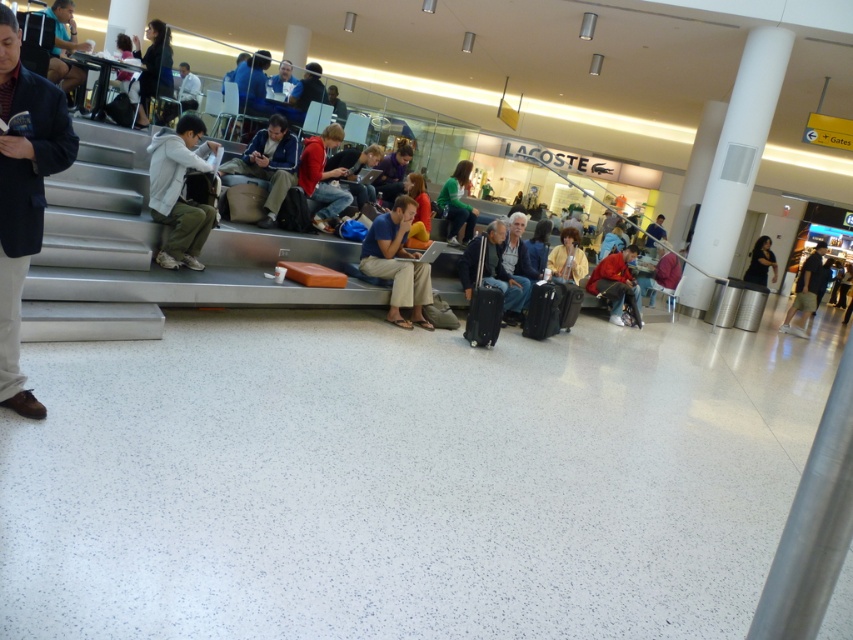
The width and height of the screenshot is (853, 640). Describe the element at coordinates (22, 195) in the screenshot. I see `dark blue blazer at left` at that location.

This screenshot has height=640, width=853. Identify the location of dark blue blazer at left. (22, 195).

The height and width of the screenshot is (640, 853). Identify the location of dark blue blazer at left. (22, 195).

Who is more forward, (556,310) or (567,316)?

Point (556,310) is in front.

Is black matte suitcase at center to the left of black fabric suitcase at center from the viewer's perspective?

Yes, black matte suitcase at center is to the left of black fabric suitcase at center.

Is point (560, 294) in front of point (567, 316)?

Yes, point (560, 294) is closer to viewer.

Locate an element on the screen. The width and height of the screenshot is (853, 640). black matte suitcase at center is located at coordinates (543, 310).

Who is positioned more to the left, black fabric dress at lower right or black fabric suitcase at center?

black fabric suitcase at center

This screenshot has height=640, width=853. What do you see at coordinates (759, 262) in the screenshot?
I see `black fabric dress at lower right` at bounding box center [759, 262].

Which is behind, point (751, 278) or point (573, 323)?

Positioned behind is point (751, 278).

The image size is (853, 640). I want to click on black fabric dress at lower right, so click(759, 262).